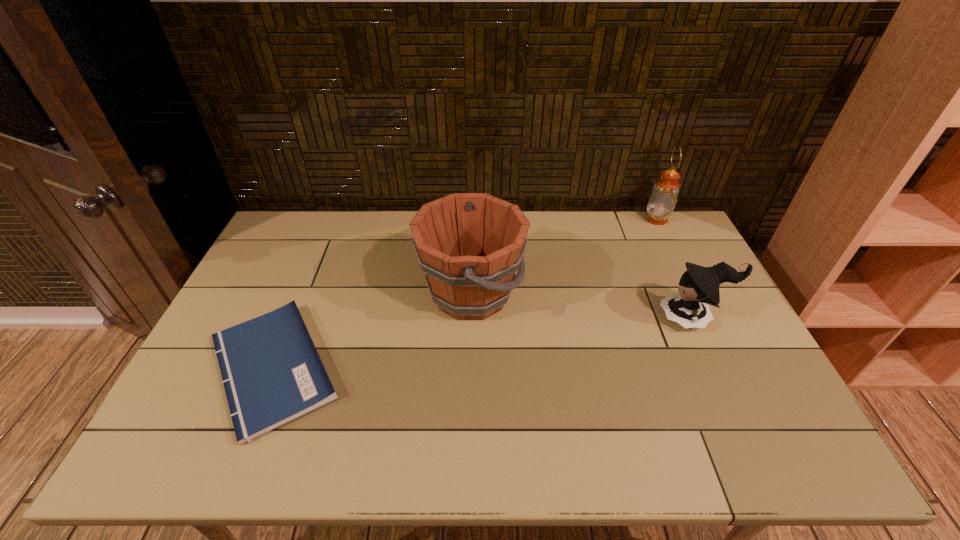
Select which object appears as the second closest to the third object from right to left. Please provide its 2D coordinates. Your answer should be formatted as a tuple, i.e. [(x, y)], where the tuple contains the x and y coordinates of a point satisfying the conditions above.

[(699, 285)]

Locate an element on the screen. vacant point that satisfies the following two spatial constraints: 1. on the handle side of the bucket; 2. on the front side of the shortest object is located at coordinates (469, 368).

The height and width of the screenshot is (540, 960). I want to click on free space that satisfies the following two spatial constraints: 1. at the face of the doll; 2. on the front side of the shortest object, so click(716, 368).

I want to click on vacant space that satisfies the following two spatial constraints: 1. on the front side of the oil lamp; 2. at the face of the third tallest object, so click(x=706, y=318).